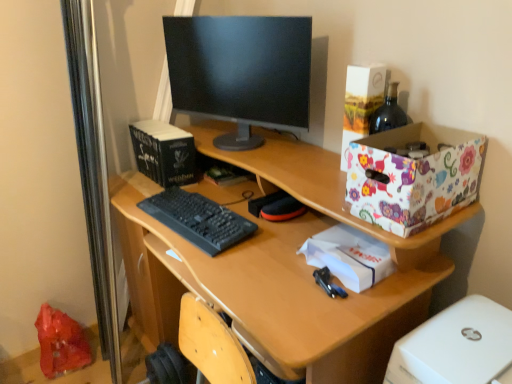
At what (x,y) coordinates should I click in order to perform the action: click on free space between black glossy monitor at center and floral paper box at upper right. Please return your answer as a coordinate pair (x, y). This screenshot has width=512, height=384. Looking at the image, I should click on (314, 164).